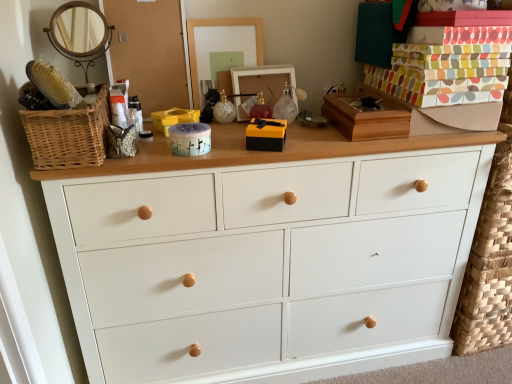
You are a GUI agent. You are given a task and a screenshot of the screen. Output one action in this format:
    pyautogui.click(x=<x>, y=<y>)
    Task: Click on the space that is in front of yellow plastic storage box at center
    
    Given the screenshot: What is the action you would take?
    click(x=175, y=162)